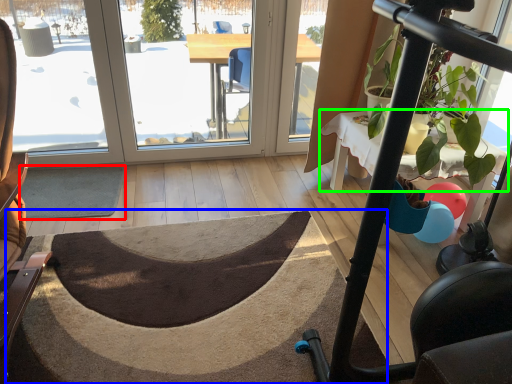
Question: Estimate the real-world distances between objects in this image. Which object is closer to doormat (highlighted by a red box), doormat (highlighted by a blue box) or table (highlighted by a green box)?

Choices:
 (A) doormat
 (B) table

Answer: (A)